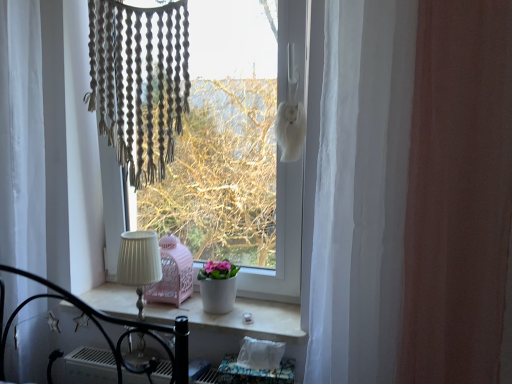
Question: From a real-world perspective, is white sheer curtain at right, which appears as the first curtain when viewed from the front, on top of white pleated fabric at center?

Choices:
 (A) no
 (B) yes

Answer: (B)

Question: Considering the relative sizes of white sheer curtain at right, which appears as the first curtain when viewed from the front, and white pleated fabric at center in the image provided, is white sheer curtain at right, which appears as the first curtain when viewed from the front, thinner than white pleated fabric at center?

Choices:
 (A) no
 (B) yes

Answer: (A)

Question: Considering the relative positions of white sheer curtain at right, which appears as the 2th curtain when viewed from the left, and white pleated fabric at center in the image provided, is white sheer curtain at right, which appears as the 2th curtain when viewed from the left, to the right of white pleated fabric at center from the viewer's perspective?

Choices:
 (A) no
 (B) yes

Answer: (B)

Question: From a real-world perspective, is white sheer curtain at right, which appears as the first curtain when viewed from the front, located beneath white pleated fabric at center?

Choices:
 (A) yes
 (B) no

Answer: (B)

Question: Is the position of white sheer curtain at right, which appears as the 2th curtain when viewed from the left, less distant than that of white pleated fabric at center?

Choices:
 (A) yes
 (B) no

Answer: (A)

Question: Can you confirm if white sheer curtain at right, which appears as the 2th curtain when viewed from the left, is shorter than white pleated fabric at center?

Choices:
 (A) yes
 (B) no

Answer: (B)

Question: From the image's perspective, is white sheer curtain at right, which appears as the 2th curtain when viewed from the left, above white matte window at center?

Choices:
 (A) yes
 (B) no

Answer: (B)

Question: Can you confirm if white sheer curtain at right, which appears as the first curtain when viewed from the front, is shorter than white matte window at center?

Choices:
 (A) no
 (B) yes

Answer: (A)

Question: From a real-world perspective, is white sheer curtain at right, which appears as the 2th curtain when viewed from the left, physically above white matte window at center?

Choices:
 (A) yes
 (B) no

Answer: (B)

Question: Is white sheer curtain at right, which is counted as the 2th curtain, starting from the back, thinner than white matte window at center?

Choices:
 (A) no
 (B) yes

Answer: (B)

Question: Is white sheer curtain at right, which appears as the first curtain when viewed from the front, in front of white matte window at center?

Choices:
 (A) no
 (B) yes

Answer: (B)

Question: Is there a large distance between white sheer curtain at right, which appears as the 2th curtain when viewed from the left, and white matte window at center?

Choices:
 (A) yes
 (B) no

Answer: (B)

Question: Does white ceramic window sill at center have a smaller size compared to white matte pot at center?

Choices:
 (A) yes
 (B) no

Answer: (B)